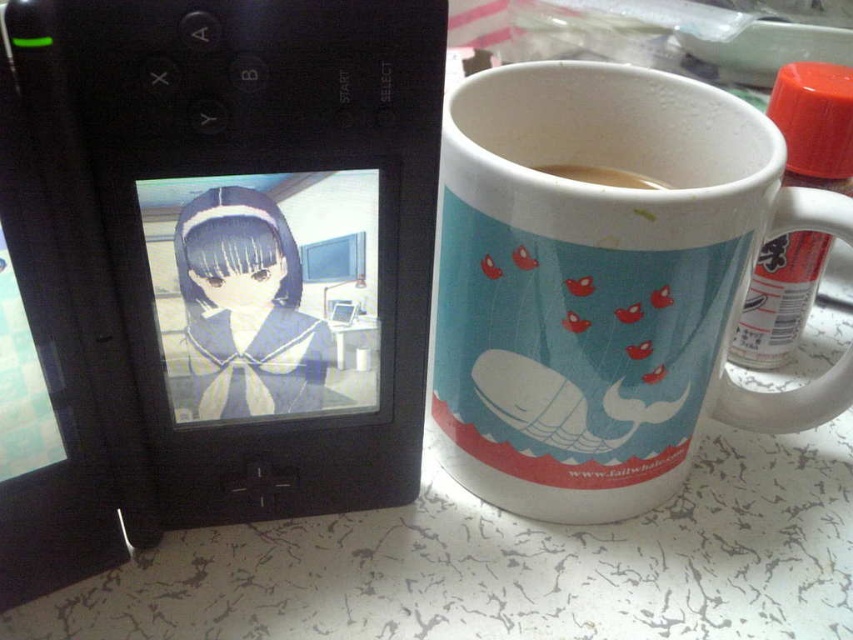
Question: Which of these objects is positioned closest to the matte black anime girl at left?

Choices:
 (A) brown matte coffee at upper right
 (B) white ceramic mug at right

Answer: (B)

Question: Estimate the real-world distances between objects in this image. Which object is farther from the brown matte coffee at upper right?

Choices:
 (A) matte black anime girl at left
 (B) white ceramic mug at right

Answer: (A)

Question: Does matte black anime girl at left lie behind brown matte coffee at upper right?

Choices:
 (A) no
 (B) yes

Answer: (A)

Question: Is white ceramic mug at right bigger than matte black anime girl at left?

Choices:
 (A) yes
 (B) no

Answer: (A)

Question: Which point is farther to the camera?

Choices:
 (A) (257, 284)
 (B) (583, 380)
 (C) (619, 180)

Answer: (C)

Question: Does matte black anime girl at left have a greater width compared to brown matte coffee at upper right?

Choices:
 (A) no
 (B) yes

Answer: (A)